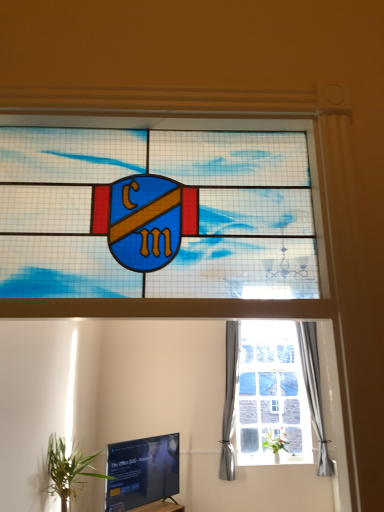
How much space does silky gray curtain at right, which is counted as the 2th curtain, starting from the left, occupy horizontally?

The width of silky gray curtain at right, which is counted as the 2th curtain, starting from the left, is 8.27 inches.

Identify the location of green leafy plant at center, the first houseplant in the right-to-left sequence. The height and width of the screenshot is (512, 384). (275, 446).

The image size is (384, 512). Find the location of `stained glass shield at center`. stained glass shield at center is located at coordinates (156, 214).

What do you see at coordinates (68, 471) in the screenshot? This screenshot has width=384, height=512. I see `green leafy plant at lower left, the second houseplant when ordered from back to front` at bounding box center [68, 471].

The width and height of the screenshot is (384, 512). I want to click on silky gray curtain at right, which is counted as the 2th curtain, starting from the left, so pyautogui.click(x=314, y=390).

Is green leafy plant at lower left, the first houseplant from the top, next to green leafy plant at center, arranged as the 2th houseplant when viewed from the front?

No, green leafy plant at lower left, the first houseplant from the top, is not in contact with green leafy plant at center, arranged as the 2th houseplant when viewed from the front.

Can you confirm if green leafy plant at lower left, which is the 1th houseplant in left-to-right order, is thinner than green leafy plant at center, acting as the 2th houseplant starting from the left?

In fact, green leafy plant at lower left, which is the 1th houseplant in left-to-right order, might be wider than green leafy plant at center, acting as the 2th houseplant starting from the left.

Which of these two, green leafy plant at lower left, which is the 1th houseplant in left-to-right order, or green leafy plant at center, acting as the 2th houseplant starting from the left, is smaller?

green leafy plant at center, acting as the 2th houseplant starting from the left, is smaller.

Does green leafy plant at lower left, which ranks as the 2th houseplant in right-to-left order, lie behind green leafy plant at center, which ranks as the first houseplant in back-to-front order?

No, it is not.

Find the location of a particular element. The width and height of the screenshot is (384, 512). curtain that is in front of the silky gray curtain at right, arranged as the first curtain when viewed from the right is located at coordinates (229, 401).

Measure the distance from gray fabric curtain at right, which ranks as the first curtain in left-to-right order, to silky gray curtain at right, which is counted as the 2th curtain, starting from the left.

A distance of 6.44 feet exists between gray fabric curtain at right, which ranks as the first curtain in left-to-right order, and silky gray curtain at right, which is counted as the 2th curtain, starting from the left.

Which of these two, gray fabric curtain at right, which appears as the 2th curtain when viewed from the right, or silky gray curtain at right, arranged as the first curtain when viewed from the right, stands taller?

gray fabric curtain at right, which appears as the 2th curtain when viewed from the right.

Is gray fabric curtain at right, which ranks as the first curtain in left-to-right order, looking in the opposite direction of silky gray curtain at right, arranged as the first curtain when viewed from the right?

gray fabric curtain at right, which ranks as the first curtain in left-to-right order, is not turned away from silky gray curtain at right, arranged as the first curtain when viewed from the right.

Considering the relative sizes of black glossy tv at lower left and stained glass shield at center in the image provided, is black glossy tv at lower left bigger than stained glass shield at center?

Indeed, black glossy tv at lower left has a larger size compared to stained glass shield at center.

From the picture: From the image's perspective, is black glossy tv at lower left on stained glass shield at center?

No, from the image's perspective, black glossy tv at lower left is not above stained glass shield at center.

Can stained glass shield at center be found inside black glossy tv at lower left?

No, stained glass shield at center is not inside black glossy tv at lower left.

Find the location of a particular element. television below the stained glass shield at center (from the image's perspective) is located at coordinates (141, 472).

Is black glossy tv at lower left in contact with gray fabric curtain at right, which ranks as the first curtain in left-to-right order?

No, black glossy tv at lower left is not beside gray fabric curtain at right, which ranks as the first curtain in left-to-right order.

Considering their positions, is black glossy tv at lower left located in front of or behind gray fabric curtain at right, which ranks as the first curtain in left-to-right order?

Clearly, black glossy tv at lower left is in front of gray fabric curtain at right, which ranks as the first curtain in left-to-right order.

Is point (305, 387) closer or farther from the camera than point (282, 441)?

Point (305, 387).

Considering the relative positions of silky gray curtain at right, which is counted as the 2th curtain, starting from the left, and green leafy plant at center, arranged as the 2th houseplant when viewed from the front, in the image provided, is silky gray curtain at right, which is counted as the 2th curtain, starting from the left, to the right of green leafy plant at center, arranged as the 2th houseplant when viewed from the front, from the viewer's perspective?

Indeed, silky gray curtain at right, which is counted as the 2th curtain, starting from the left, is positioned on the right side of green leafy plant at center, arranged as the 2th houseplant when viewed from the front.

Is silky gray curtain at right, arranged as the first curtain when viewed from the right, completely or partially outside of green leafy plant at center, the first houseplant in the right-to-left sequence?

Yes, silky gray curtain at right, arranged as the first curtain when viewed from the right, is outside of green leafy plant at center, the first houseplant in the right-to-left sequence.

Considering the relative sizes of silky gray curtain at right, which is counted as the 2th curtain, starting from the left, and green leafy plant at center, the first houseplant in the right-to-left sequence, in the image provided, is silky gray curtain at right, which is counted as the 2th curtain, starting from the left, bigger than green leafy plant at center, the first houseplant in the right-to-left sequence,?

Yes.

Choose the correct answer: Is stained glass shield at center inside green leafy plant at center, acting as the 2th houseplant starting from the left, or outside it?

stained glass shield at center exists outside the volume of green leafy plant at center, acting as the 2th houseplant starting from the left.

In the scene shown: From the image's perspective, which is above, stained glass shield at center or green leafy plant at center, the first houseplant in the right-to-left sequence?

stained glass shield at center, from the image's perspective.

Is point (252, 229) more distant than point (285, 440)?

No, it is not.

Is green leafy plant at lower left, the 1th houseplant in the front-to-back sequence, oriented towards silky gray curtain at right, arranged as the first curtain when viewed from the right?

No, green leafy plant at lower left, the 1th houseplant in the front-to-back sequence, does not turn towards silky gray curtain at right, arranged as the first curtain when viewed from the right.

Are green leafy plant at lower left, the 2th houseplant from the bottom, and silky gray curtain at right, which is counted as the 2th curtain, starting from the left, beside each other?

No, green leafy plant at lower left, the 2th houseplant from the bottom, is not with silky gray curtain at right, which is counted as the 2th curtain, starting from the left.

Looking at this image, between green leafy plant at lower left, the first houseplant from the top, and silky gray curtain at right, which is counted as the 2th curtain, starting from the left, which one appears on the right side from the viewer's perspective?

silky gray curtain at right, which is counted as the 2th curtain, starting from the left.

I want to click on houseplant on the right side of green leafy plant at lower left, which ranks as the 2th houseplant in right-to-left order, so click(275, 446).

The height and width of the screenshot is (512, 384). Find the location of `curtain to the left of silky gray curtain at right, arranged as the first curtain when viewed from the right`. curtain to the left of silky gray curtain at right, arranged as the first curtain when viewed from the right is located at coordinates (229, 401).

Estimate the real-world distances between objects in this image. Which object is closer to green leafy plant at center, arranged as the 2th houseplant when viewed from the front, silky gray curtain at right, arranged as the first curtain when viewed from the right, or green leafy plant at lower left, which is the 1th houseplant in left-to-right order?

Among the two, silky gray curtain at right, arranged as the first curtain when viewed from the right, is located nearer to green leafy plant at center, arranged as the 2th houseplant when viewed from the front.

When comparing their distances from black glossy tv at lower left, does green leafy plant at center, arranged as the 2th houseplant when viewed from the front, or gray fabric curtain at right, which ranks as the first curtain in left-to-right order, seem further?

The object further to black glossy tv at lower left is green leafy plant at center, arranged as the 2th houseplant when viewed from the front.

Estimate the real-world distances between objects in this image. Which object is closer to green leafy plant at center, which ranks as the first houseplant in back-to-front order, gray fabric curtain at right, which ranks as the first curtain in left-to-right order, or silky gray curtain at right, arranged as the first curtain when viewed from the right?

gray fabric curtain at right, which ranks as the first curtain in left-to-right order, lies closer to green leafy plant at center, which ranks as the first houseplant in back-to-front order, than the other object.

Estimate the real-world distances between objects in this image. Which object is further from black glossy tv at lower left, green leafy plant at center, placed as the 2th houseplant when sorted from top to bottom, or stained glass shield at center?

stained glass shield at center is further to black glossy tv at lower left.

Considering their positions, is stained glass shield at center positioned closer to gray fabric curtain at right, which appears as the 2th curtain when viewed from the right, than silky gray curtain at right, arranged as the first curtain when viewed from the right?

Based on the image, silky gray curtain at right, arranged as the first curtain when viewed from the right, appears to be nearer to gray fabric curtain at right, which appears as the 2th curtain when viewed from the right.

From the image, which object appears to be nearer to silky gray curtain at right, arranged as the first curtain when viewed from the right, green leafy plant at center, placed as the 2th houseplant when sorted from top to bottom, or black glossy tv at lower left?

A: green leafy plant at center, placed as the 2th houseplant when sorted from top to bottom, lies closer to silky gray curtain at right, arranged as the first curtain when viewed from the right, than the other object.

Which object lies further to the anchor point stained glass shield at center, green leafy plant at lower left, which is the 1th houseplant in left-to-right order, or black glossy tv at lower left?

Among the two, black glossy tv at lower left is located further to stained glass shield at center.

Which object lies nearer to the anchor point green leafy plant at center, placed as the 2th houseplant when sorted from top to bottom, gray fabric curtain at right, which ranks as the first curtain in left-to-right order, or stained glass shield at center?

Among the two, gray fabric curtain at right, which ranks as the first curtain in left-to-right order, is located nearer to green leafy plant at center, placed as the 2th houseplant when sorted from top to bottom.

Find the location of `television between green leafy plant at lower left, the 1th houseplant in the front-to-back sequence, and gray fabric curtain at right, which ranks as the first curtain in left-to-right order, from front to back`. television between green leafy plant at lower left, the 1th houseplant in the front-to-back sequence, and gray fabric curtain at right, which ranks as the first curtain in left-to-right order, from front to back is located at coordinates (141, 472).

Find the location of a particular element. Image resolution: width=384 pixels, height=512 pixels. curtain located between black glossy tv at lower left and green leafy plant at center, which ranks as the first houseplant in back-to-front order, in the left-right direction is located at coordinates 229,401.

Image resolution: width=384 pixels, height=512 pixels. What are the coordinates of `houseplant between green leafy plant at lower left, which is the 1th houseplant in left-to-right order, and silky gray curtain at right, arranged as the first curtain when viewed from the right, from left to right` in the screenshot? It's located at (275, 446).

At what (x,y) coordinates should I click in order to perform the action: click on houseplant between black glossy tv at lower left and silky gray curtain at right, arranged as the first curtain when viewed from the right, in the horizontal direction. Please return your answer as a coordinate pair (x, y). The height and width of the screenshot is (512, 384). Looking at the image, I should click on (275, 446).